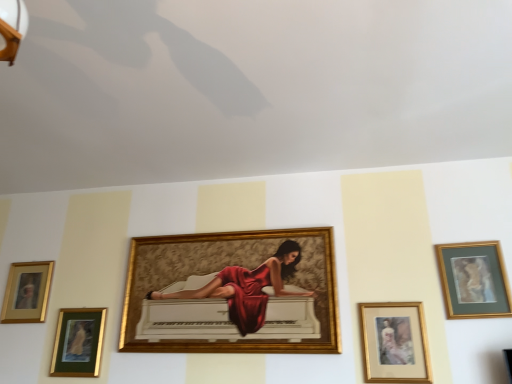
Question: Can you confirm if gold-framed painting at center, placed as the third picture frame when sorted from left to right, is thinner than gold-framed portrait at lower right, which is the 2th picture frame from right to left?

Choices:
 (A) no
 (B) yes

Answer: (A)

Question: Are gold-framed painting at center, placed as the third picture frame when sorted from left to right, and gold-framed portrait at lower right, which is the 2th picture frame from right to left, making contact?

Choices:
 (A) no
 (B) yes

Answer: (A)

Question: Is gold-framed painting at center, which appears as the third picture frame when viewed from the right, further to camera compared to gold-framed portrait at lower right, which is the 2th picture frame from right to left?

Choices:
 (A) yes
 (B) no

Answer: (A)

Question: From the image's perspective, is gold-framed painting at center, placed as the third picture frame when sorted from left to right, located beneath gold-framed portrait at lower right, marked as the fourth picture frame in a left-to-right arrangement?

Choices:
 (A) yes
 (B) no

Answer: (B)

Question: Considering the relative sizes of gold-framed painting at center, which appears as the third picture frame when viewed from the right, and gold-framed portrait at lower right, marked as the fourth picture frame in a left-to-right arrangement, in the image provided, is gold-framed painting at center, which appears as the third picture frame when viewed from the right, shorter than gold-framed portrait at lower right, marked as the fourth picture frame in a left-to-right arrangement,?

Choices:
 (A) yes
 (B) no

Answer: (B)

Question: Can you confirm if gold-framed painting at center, which appears as the third picture frame when viewed from the right, is wider than gold-framed portrait at lower right, which is the 2th picture frame from right to left?

Choices:
 (A) yes
 (B) no

Answer: (A)

Question: Does gold-framed artwork at upper right, placed as the first picture frame when sorted from right to left, have a greater height compared to gold-framed painting at center, placed as the third picture frame when sorted from left to right?

Choices:
 (A) no
 (B) yes

Answer: (A)

Question: Is gold-framed artwork at upper right, placed as the first picture frame when sorted from right to left, touching gold-framed painting at center, which appears as the third picture frame when viewed from the right?

Choices:
 (A) yes
 (B) no

Answer: (B)

Question: Are gold-framed artwork at upper right, placed as the first picture frame when sorted from right to left, and gold-framed painting at center, which appears as the third picture frame when viewed from the right, far apart?

Choices:
 (A) no
 (B) yes

Answer: (A)

Question: Can you confirm if gold-framed artwork at upper right, placed as the first picture frame when sorted from right to left, is wider than gold-framed painting at center, placed as the third picture frame when sorted from left to right?

Choices:
 (A) yes
 (B) no

Answer: (B)

Question: Is gold-framed artwork at upper right, placed as the first picture frame when sorted from right to left, located outside gold-framed painting at center, placed as the third picture frame when sorted from left to right?

Choices:
 (A) no
 (B) yes

Answer: (B)

Question: Does gold-framed artwork at upper right, which appears as the fifth picture frame when viewed from the left, turn towards gold-framed painting at center, which appears as the third picture frame when viewed from the right?

Choices:
 (A) no
 (B) yes

Answer: (A)

Question: Is gold-framed artwork at upper right, which appears as the fifth picture frame when viewed from the left, in front of gold/glossy picture frame at lower left, the 5th picture frame viewed from the right?

Choices:
 (A) yes
 (B) no

Answer: (A)